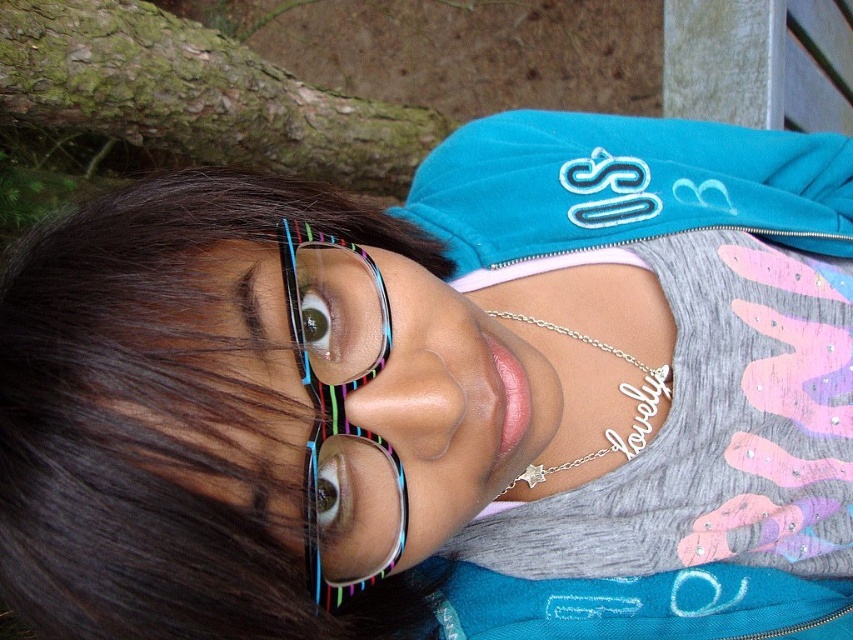
You are taking a photo of two points in the scene. The first point is at coordinate point [177,372] and the second is at point [334,394]. Which point will appear larger in your photo?

Point [177,372] is closer to the camera than point [334,394], so it will appear larger in the photo.

You are a photographer setting up a shot of the person in the scene. You need to place a new accessory between the multicolored plastic glasses at upper left and the rainbow striped glasses at center. If the space between them is 2.63 inches, can you fit a 3.0 inch wide accessory there?

The space between the multicolored plastic glasses at upper left and the rainbow striped glasses at center is 2.63 inches, which is smaller than the 3.0 inch wide accessory. Therefore, the accessory cannot be placed there without overlapping the existing glasses.

You are trying to decide which set of glasses to choose for a party. The multicolored plastic glasses at upper left and the rainbow striped glasses at center are both options. Based on their sizes, which one could potentially hold more liquid?

The multicolored plastic glasses at upper left might be wider than rainbow striped glasses at center, so they could potentially hold more liquid.